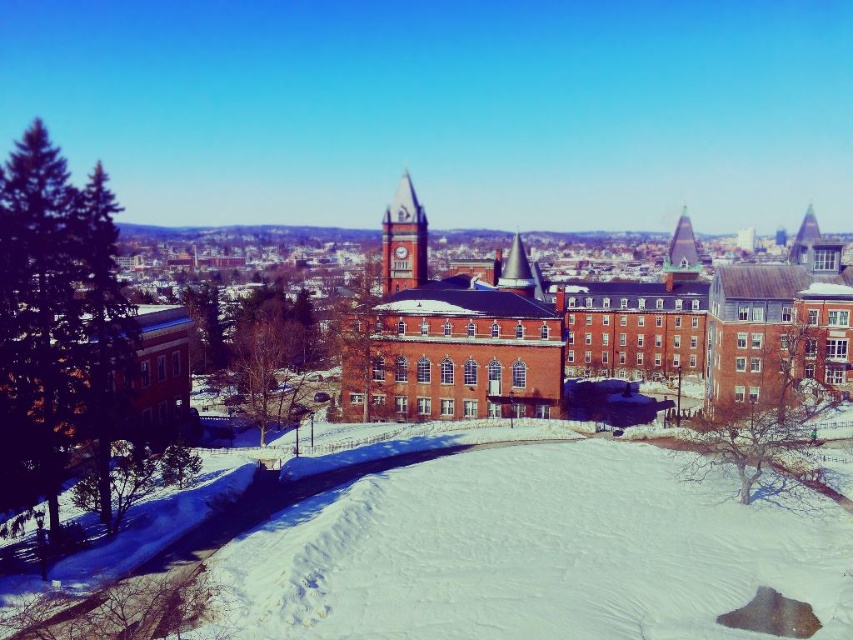
Question: Is smooth glass pyramid at upper right thinner than smooth gray spire at center?

Choices:
 (A) no
 (B) yes

Answer: (A)

Question: Which point is farther to the camera?

Choices:
 (A) matte brick clock tower at center
 (B) smooth gray spire at center

Answer: (A)

Question: Can you confirm if matte brick clock tower at center is positioned above smooth glass pyramid at upper right?

Choices:
 (A) no
 (B) yes

Answer: (A)

Question: Among these points, which one is farthest from the camera?

Choices:
 (A) (700, 259)
 (B) (532, 296)

Answer: (A)

Question: Can you confirm if smooth glass pyramid at upper right is wider than smooth gray spire at center?

Choices:
 (A) yes
 (B) no

Answer: (A)

Question: Estimate the real-world distances between objects in this image. Which object is farther from the matte brick clock tower at center?

Choices:
 (A) smooth glass pyramid at upper right
 (B) smooth gray spire at center

Answer: (A)